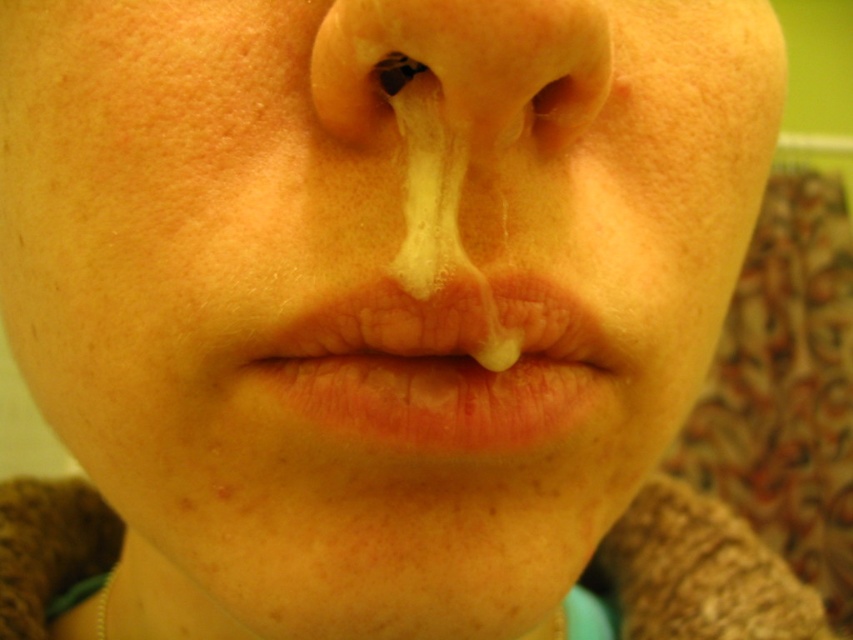
Does point (556, 362) come behind point (527, 35)?

Yes, point (556, 362) is farther from viewer.

This screenshot has width=853, height=640. I want to click on dry matte lips at center, so click(x=445, y=364).

This screenshot has width=853, height=640. I want to click on dry matte lips at center, so click(445, 364).